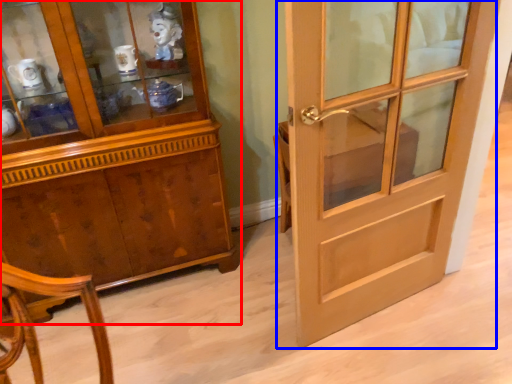
Question: Among these objects, which one is nearest to the camera, cabinetry (highlighted by a red box) or door (highlighted by a blue box)?

Choices:
 (A) cabinetry
 (B) door

Answer: (B)